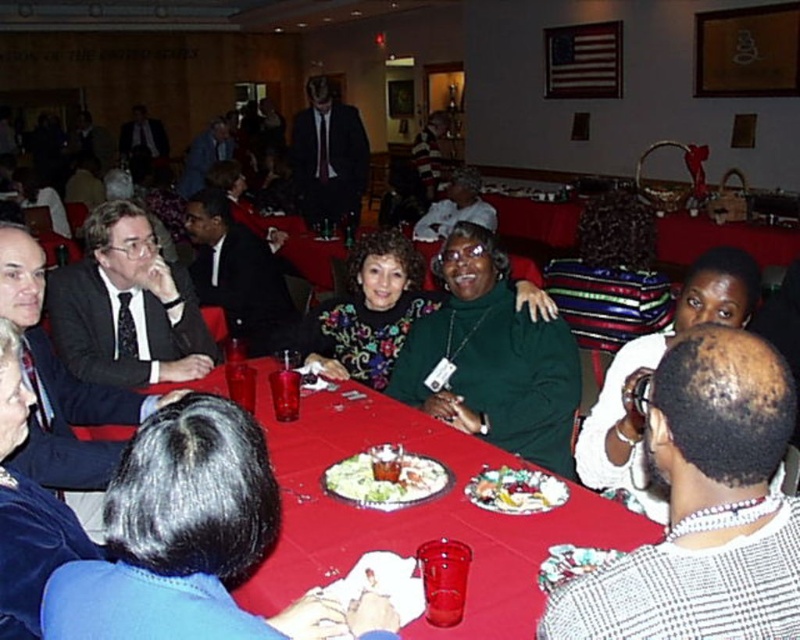
Question: Which object is positioned closest to the green matte sweater at center?

Choices:
 (A) glittery silver plate at lower center
 (B) smooth plastic table at center

Answer: (B)

Question: Is white fabric at upper right smaller than matte black suit at center?

Choices:
 (A) no
 (B) yes

Answer: (B)

Question: Does matte black suit at center lie in front of white plastic plate at center?

Choices:
 (A) no
 (B) yes

Answer: (A)

Question: Which point appears farthest from the camera in this image?

Choices:
 (A) (208, 298)
 (B) (130, 352)

Answer: (A)

Question: Which is farther from the white textured shirt at lower right?

Choices:
 (A) colorful salad at center
 (B) glittery silver plate at lower center

Answer: (A)

Question: Does dark suit at center appear on the right side of striped sweater at upper center?

Choices:
 (A) no
 (B) yes

Answer: (A)